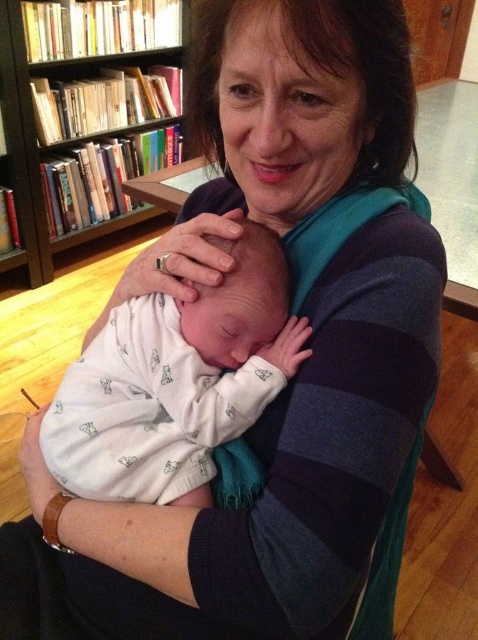
Question: Which of the following is the farthest from the observer?

Choices:
 (A) white soft swaddle at center
 (B) wooden bookcase at upper left

Answer: (B)

Question: Does white soft swaddle at center have a greater width compared to wooden bookcase at upper left?

Choices:
 (A) no
 (B) yes

Answer: (A)

Question: Which point is closer to the camera taking this photo?

Choices:
 (A) (139, 218)
 (B) (128, 376)

Answer: (B)

Question: Is white soft swaddle at center behind wooden bookcase at upper left?

Choices:
 (A) no
 (B) yes

Answer: (A)

Question: Does white soft swaddle at center appear over wooden bookcase at upper left?

Choices:
 (A) no
 (B) yes

Answer: (A)